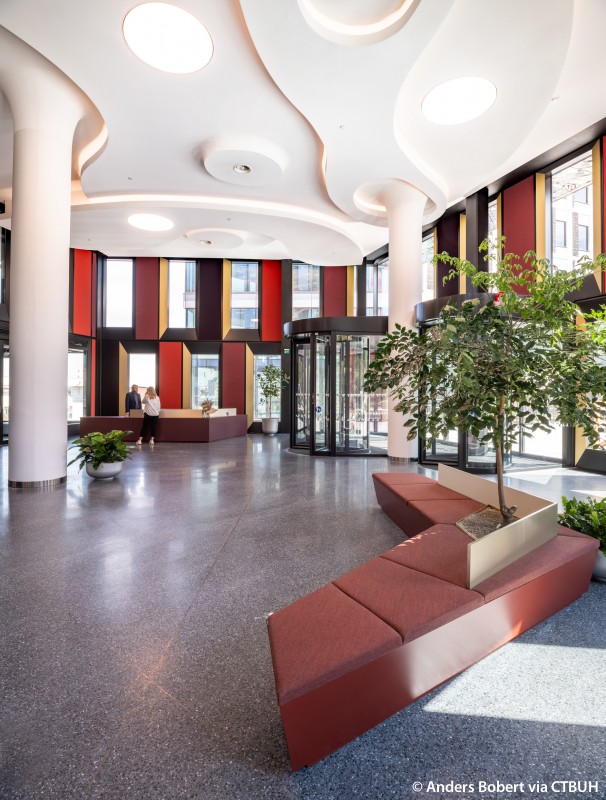
Where is `floor`? This screenshot has width=606, height=800. floor is located at coordinates (528, 714), (182, 584).